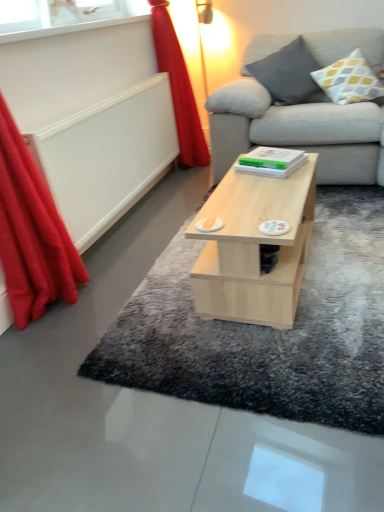
Find the location of `vacant space positioned to the left of light wood coffee table at center`. vacant space positioned to the left of light wood coffee table at center is located at coordinates click(x=153, y=310).